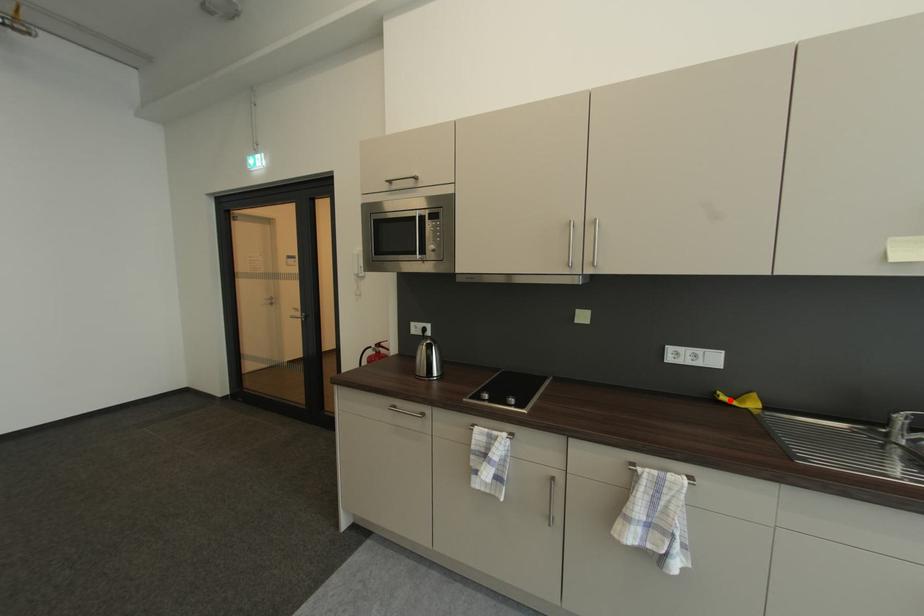
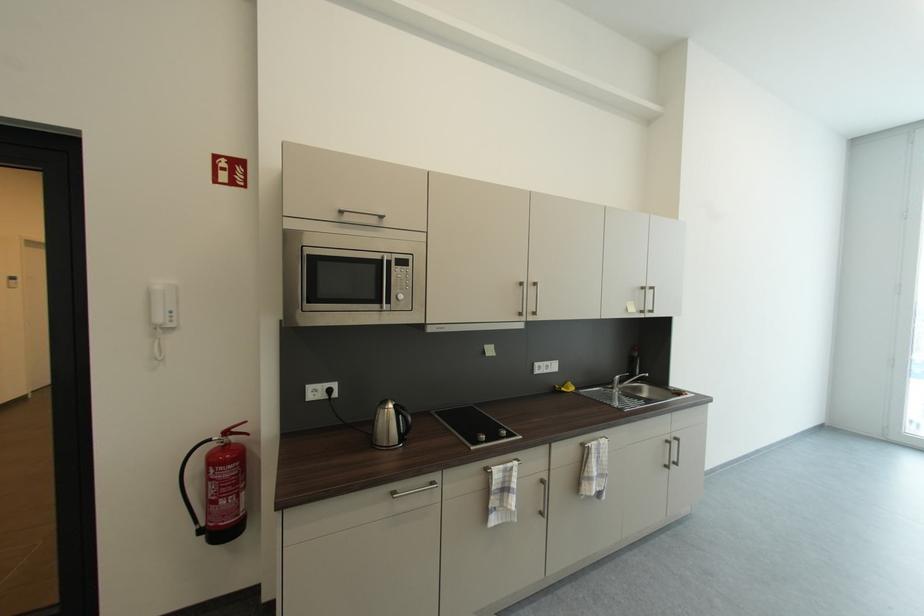
Locate, in the second image, the point that corresponds to the highlighted location in the first image.

(569, 391)